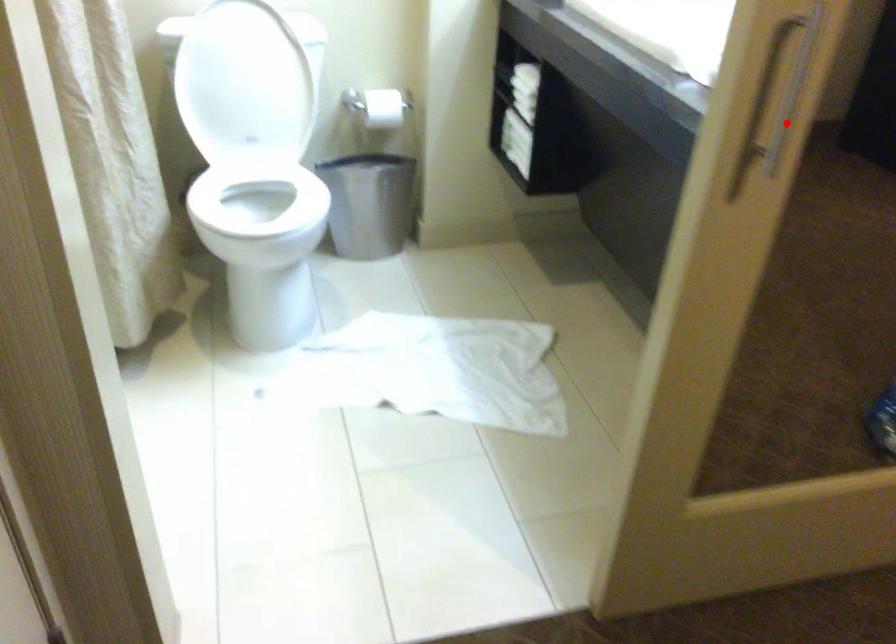
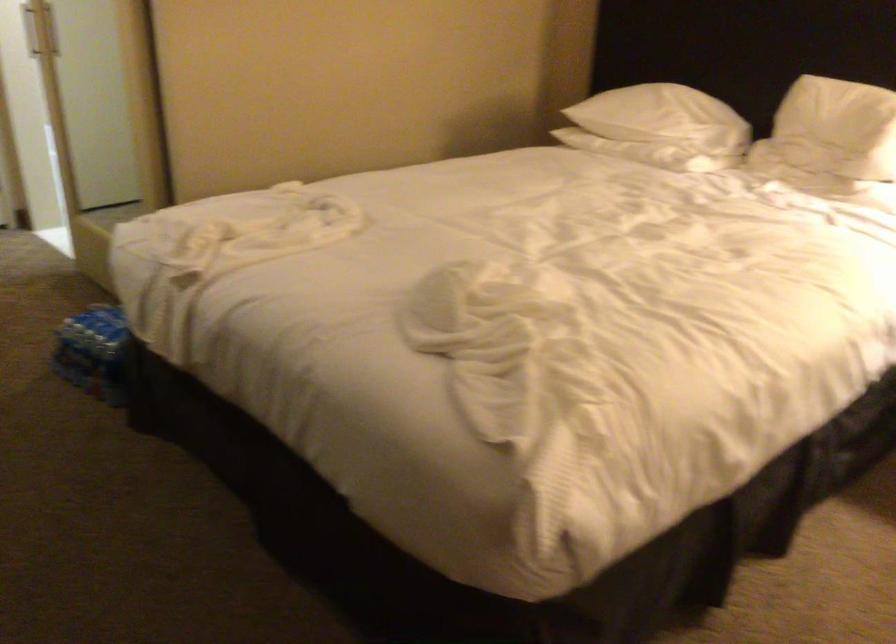
Locate, in the second image, the point that corresponds to the highlighted location in the first image.

(39, 29)